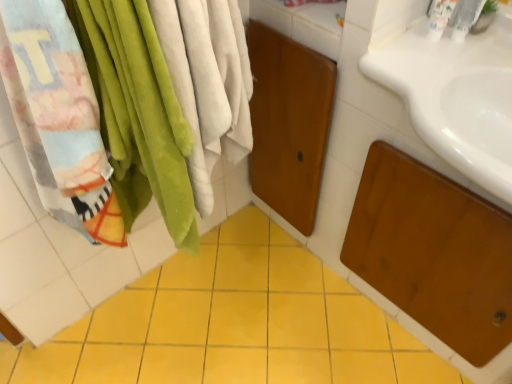
You are a GUI agent. You are given a task and a screenshot of the screen. Output one action in this format:
    pyautogui.click(x=<x>, y=<y>)
    Task: Click on the vacant space that is to the left of white plastic faucet at upper right, placed as the 2th toiletry when sorted from left to right
    This screenshot has width=512, height=384.
    Given the screenshot: What is the action you would take?
    pyautogui.click(x=401, y=64)